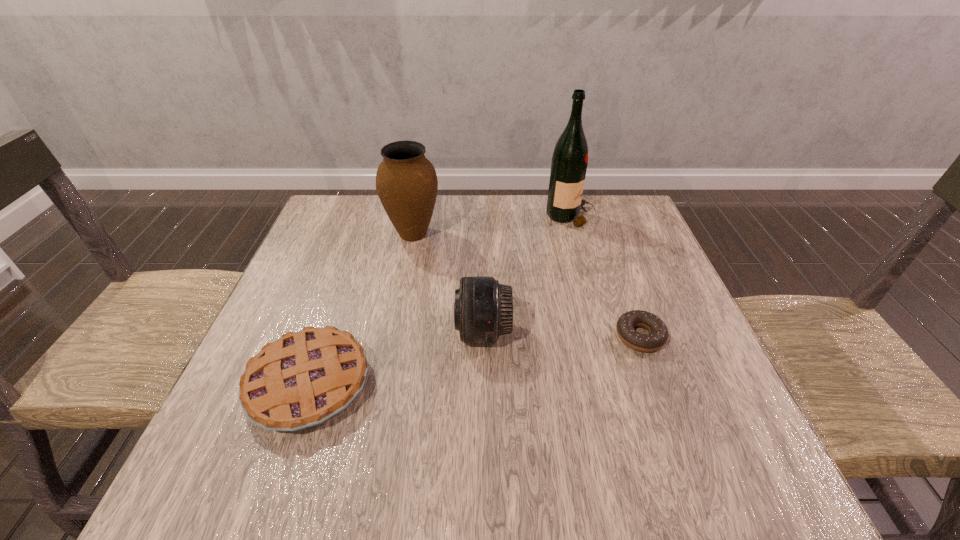
Identify the location of free space that satisfies the following two spatial constraints: 1. on the front side of the tallest object; 2. on the right side of the shortest object. (603, 336).

Find the location of `vacant space that satisfies the following two spatial constraints: 1. on the front-facing side of the third object from right to left; 2. on the left side of the shortest object`. vacant space that satisfies the following two spatial constraints: 1. on the front-facing side of the third object from right to left; 2. on the left side of the shortest object is located at coordinates (483, 336).